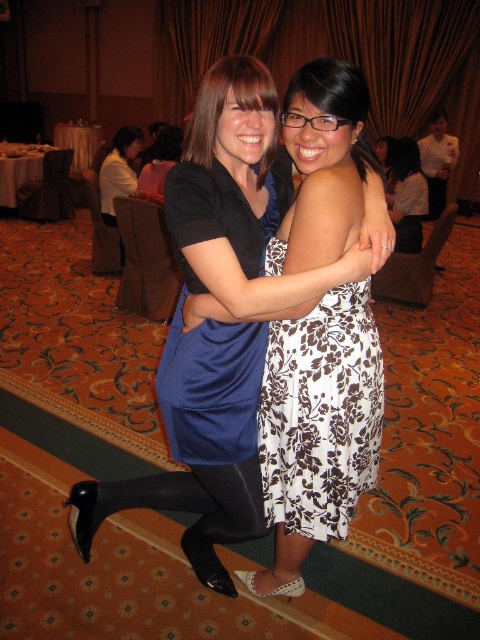
From the picture: You are at a formal event and see two dresses at the center of the image. The blue satin dress at center and the brown floral fabric dress at center. Which one is more to the left?

The blue satin dress at center is positioned on the left side of brown floral fabric dress at center, so the blue satin dress at center is more to the left.

You are at a social event and want to take a photo of both the blue satin dress at center and the brown floral fabric dress at center. Which dress should you focus on first to ensure both are in the frame?

You should focus on the blue satin dress at center first since it is closer to the viewer than the brown floral fabric dress at center, ensuring both are in the frame.

You are a photographer at a social event and need to capture a photo of both the blue satin dress at center and the matte blue dress at center. Which dress should you focus on first to ensure it appears larger in the photo?

The blue satin dress at center is taller than the matte blue dress at center, so focusing on the blue satin dress at center first will ensure it appears larger in the photo.